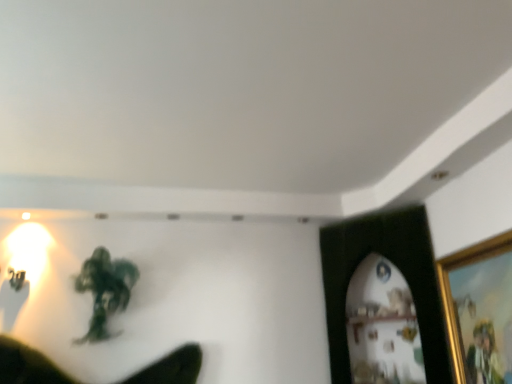
What do you see at coordinates (479, 310) in the screenshot? This screenshot has height=384, width=512. I see `gold-framed picture at right, which is the first picture frame from front to back` at bounding box center [479, 310].

Where is `black matte picture frame at upper right, which appears as the 2th picture frame when viewed from the front`? The image size is (512, 384). black matte picture frame at upper right, which appears as the 2th picture frame when viewed from the front is located at coordinates (394, 263).

From a real-world perspective, is gold-framed picture at right, which is the first picture frame from front to back, positioned over green matte figure at center based on gravity?

No, from a real-world perspective, gold-framed picture at right, which is the first picture frame from front to back, is not over green matte figure at center

Consider the image. Considering the sizes of objects gold-framed picture at right, which is the first picture frame from front to back, and green matte figure at center in the image provided, who is shorter, gold-framed picture at right, which is the first picture frame from front to back, or green matte figure at center?

With less height is green matte figure at center.

Between gold-framed picture at right, marked as the second picture frame in a back-to-front arrangement, and green matte figure at center, which one has larger size?

With larger size is green matte figure at center.

Which object is closer to the camera, gold-framed picture at right, which is the first picture frame from front to back, or green matte figure at center?

gold-framed picture at right, which is the first picture frame from front to back.

The width and height of the screenshot is (512, 384). Find the location of `person behind the black matte picture frame at upper right, the first picture frame positioned from the back`. person behind the black matte picture frame at upper right, the first picture frame positioned from the back is located at coordinates (105, 290).

In the image, is black matte picture frame at upper right, which appears as the 2th picture frame when viewed from the front, positioned in front of or behind green matte figure at center?

black matte picture frame at upper right, which appears as the 2th picture frame when viewed from the front, is in front of green matte figure at center.

Is black matte picture frame at upper right, which appears as the 2th picture frame when viewed from the front, positioned with its back to green matte figure at center?

black matte picture frame at upper right, which appears as the 2th picture frame when viewed from the front, is not turned away from green matte figure at center.

Considering the relative sizes of black matte picture frame at upper right, the first picture frame positioned from the back, and green matte figure at center in the image provided, is black matte picture frame at upper right, the first picture frame positioned from the back, bigger than green matte figure at center?

Yes, black matte picture frame at upper right, the first picture frame positioned from the back, is bigger than green matte figure at center.

Is green matte figure at center completely or partially outside of black matte picture frame at upper right, which appears as the 2th picture frame when viewed from the front?

Yes, green matte figure at center is located beyond the bounds of black matte picture frame at upper right, which appears as the 2th picture frame when viewed from the front.

Considering the sizes of green matte figure at center and black matte picture frame at upper right, the first picture frame positioned from the back, in the image, is green matte figure at center bigger or smaller than black matte picture frame at upper right, the first picture frame positioned from the back,?

In the image, green matte figure at center appears to be smaller than black matte picture frame at upper right, the first picture frame positioned from the back.

Is point (102, 329) closer or farther from the camera than point (345, 287)?

Point (102, 329) appears to be closer to the viewer than point (345, 287).

Looking at this image, could you tell me if green matte figure at center is turned towards black matte picture frame at upper right, which appears as the 2th picture frame when viewed from the front?

No, green matte figure at center is not oriented towards black matte picture frame at upper right, which appears as the 2th picture frame when viewed from the front.

From a real-world perspective, is green matte figure at center located beneath gold-framed picture at right, which is the first picture frame from front to back?

Actually, green matte figure at center is physically above gold-framed picture at right, which is the first picture frame from front to back, in the real world.

Looking at this image, can you tell me how much green matte figure at center and gold-framed picture at right, marked as the second picture frame in a back-to-front arrangement, differ in facing direction?

The facing directions of green matte figure at center and gold-framed picture at right, marked as the second picture frame in a back-to-front arrangement, are 89.7 degrees apart.

Would you say green matte figure at center is a long distance from gold-framed picture at right, which is the first picture frame from front to back?

That's right, there is a large distance between green matte figure at center and gold-framed picture at right, which is the first picture frame from front to back.

Identify the location of picture frame located behind the gold-framed picture at right, marked as the second picture frame in a back-to-front arrangement. The width and height of the screenshot is (512, 384). click(394, 263).

Does gold-framed picture at right, marked as the second picture frame in a back-to-front arrangement, have a greater height compared to black matte picture frame at upper right, which appears as the 2th picture frame when viewed from the front?

No, gold-framed picture at right, marked as the second picture frame in a back-to-front arrangement, is not taller than black matte picture frame at upper right, which appears as the 2th picture frame when viewed from the front.

Is gold-framed picture at right, which is the first picture frame from front to back, oriented away from black matte picture frame at upper right, which appears as the 2th picture frame when viewed from the front?

No, gold-framed picture at right, which is the first picture frame from front to back, is not facing away from black matte picture frame at upper right, which appears as the 2th picture frame when viewed from the front.

Between gold-framed picture at right, which is the first picture frame from front to back, and black matte picture frame at upper right, which appears as the 2th picture frame when viewed from the front, which one has larger width?

black matte picture frame at upper right, which appears as the 2th picture frame when viewed from the front.

Is black matte picture frame at upper right, which appears as the 2th picture frame when viewed from the front, aimed at gold-framed picture at right, which is the first picture frame from front to back?

No.

Is black matte picture frame at upper right, the first picture frame positioned from the back, at the left side of gold-framed picture at right, marked as the second picture frame in a back-to-front arrangement?

Yes, black matte picture frame at upper right, the first picture frame positioned from the back, is to the left of gold-framed picture at right, marked as the second picture frame in a back-to-front arrangement.

In the scene shown: Is black matte picture frame at upper right, the first picture frame positioned from the back, far away from gold-framed picture at right, which is the first picture frame from front to back?

No, black matte picture frame at upper right, the first picture frame positioned from the back, is not far away from gold-framed picture at right, which is the first picture frame from front to back.

Where is `person behind the gold-framed picture at right, marked as the second picture frame in a back-to-front arrangement`? This screenshot has height=384, width=512. person behind the gold-framed picture at right, marked as the second picture frame in a back-to-front arrangement is located at coordinates (105, 290).

Image resolution: width=512 pixels, height=384 pixels. There is a black matte picture frame at upper right, which appears as the 2th picture frame when viewed from the front. What are the coordinates of `person above it (from a real-world perspective)` in the screenshot? It's located at [105, 290].

Estimate the real-world distances between objects in this image. Which object is further from black matte picture frame at upper right, the first picture frame positioned from the back, green matte figure at center or gold-framed picture at right, which is the first picture frame from front to back?

green matte figure at center.

From the image, which object appears to be farther from green matte figure at center, gold-framed picture at right, which is the first picture frame from front to back, or black matte picture frame at upper right, the first picture frame positioned from the back?

gold-framed picture at right, which is the first picture frame from front to back, is positioned further to the anchor green matte figure at center.

Based on their spatial positions, is gold-framed picture at right, marked as the second picture frame in a back-to-front arrangement, or green matte figure at center further from black matte picture frame at upper right, the first picture frame positioned from the back?

Among the two, green matte figure at center is located further to black matte picture frame at upper right, the first picture frame positioned from the back.

Considering their positions, is black matte picture frame at upper right, which appears as the 2th picture frame when viewed from the front, positioned further to green matte figure at center than gold-framed picture at right, which is the first picture frame from front to back?

The object further to green matte figure at center is gold-framed picture at right, which is the first picture frame from front to back.

Estimate the real-world distances between objects in this image. Which object is further from gold-framed picture at right, which is the first picture frame from front to back, green matte figure at center or black matte picture frame at upper right, the first picture frame positioned from the back?

Based on the image, green matte figure at center appears to be further to gold-framed picture at right, which is the first picture frame from front to back.

Looking at the image, which one is located closer to gold-framed picture at right, which is the first picture frame from front to back, black matte picture frame at upper right, the first picture frame positioned from the back, or green matte figure at center?

black matte picture frame at upper right, the first picture frame positioned from the back, is closer to gold-framed picture at right, which is the first picture frame from front to back.

You are a GUI agent. You are given a task and a screenshot of the screen. Output one action in this format:
    pyautogui.click(x=<x>, y=<y>)
    Task: Click on the picture frame between green matte figure at center and gold-framed picture at right, which is the first picture frame from front to back, from left to right
    This screenshot has height=384, width=512.
    Given the screenshot: What is the action you would take?
    coord(394,263)